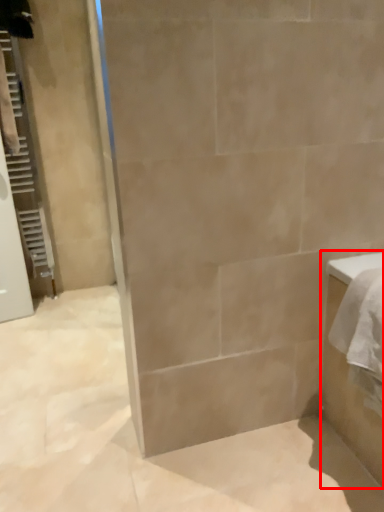
Question: In this image, where is bathroom cabinet (annotated by the red box) located relative to screen door?

Choices:
 (A) left
 (B) right

Answer: (B)